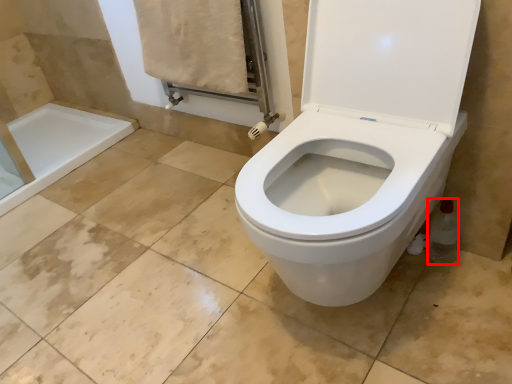
Question: Observing the image, what is the correct spatial positioning of bottle (annotated by the red box) in reference to bath towel?

Choices:
 (A) left
 (B) right

Answer: (B)